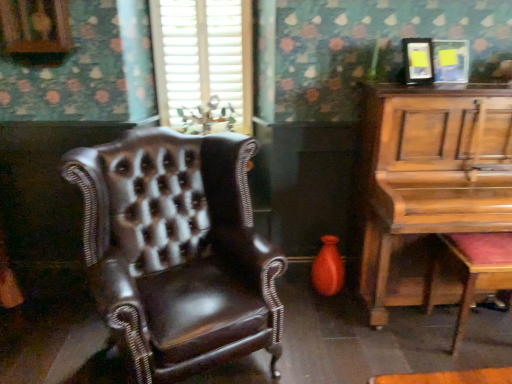
Where is `shiny brown leather chair at left`? Image resolution: width=512 pixels, height=384 pixels. shiny brown leather chair at left is located at coordinates (177, 251).

What do you see at coordinates (203, 56) in the screenshot? I see `white textured blinds at upper center` at bounding box center [203, 56].

What do you see at coordinates (474, 270) in the screenshot?
I see `wooden polished music stool at lower right` at bounding box center [474, 270].

The height and width of the screenshot is (384, 512). In order to click on shiny brown leather chair at left in this screenshot , I will do `click(177, 251)`.

From the image's perspective, is white textured blinds at upper center on wooden piano at right?

Yes, from the image's perspective, white textured blinds at upper center is over wooden piano at right.

Based on their sizes in the image, would you say white textured blinds at upper center is bigger or smaller than wooden piano at right?

Considering their sizes, white textured blinds at upper center takes up less space than wooden piano at right.

How different are the orientations of white textured blinds at upper center and wooden piano at right in degrees?

The angular difference between white textured blinds at upper center and wooden piano at right is 1.1 degrees.

From a real-world perspective, is white textured blinds at upper center physically above wooden piano at right?

Indeed, from a real-world perspective, white textured blinds at upper center stands above wooden piano at right.

Would you consider shiny brown leather chair at left to be distant from white textured blinds at upper center?

shiny brown leather chair at left is near white textured blinds at upper center, not far away.

From the image's perspective, does shiny brown leather chair at left appear lower than white textured blinds at upper center?

Yes.

In terms of height, does shiny brown leather chair at left look taller or shorter compared to white textured blinds at upper center?

Considering their sizes, shiny brown leather chair at left has less height than white textured blinds at upper center.

Where is `chair on the left of white textured blinds at upper center`? chair on the left of white textured blinds at upper center is located at coordinates (177, 251).

From a real-world perspective, relative to white textured blinds at upper center, is wooden polished music stool at lower right vertically above or below?

In terms of real-world spatial position, wooden polished music stool at lower right is below white textured blinds at upper center.

Is wooden polished music stool at lower right bigger than white textured blinds at upper center?

Indeed, wooden polished music stool at lower right has a larger size compared to white textured blinds at upper center.

Looking at this image, measure the distance between wooden polished music stool at lower right and white textured blinds at upper center.

wooden polished music stool at lower right and white textured blinds at upper center are 1.58 meters apart.

Considering the relative sizes of wooden polished music stool at lower right and white textured blinds at upper center in the image provided, is wooden polished music stool at lower right shorter than white textured blinds at upper center?

Indeed, wooden polished music stool at lower right has a lesser height compared to white textured blinds at upper center.

Considering the relative sizes of wooden polished music stool at lower right and wooden piano at right in the image provided, is wooden polished music stool at lower right wider than wooden piano at right?

Incorrect, the width of wooden polished music stool at lower right does not surpass that of wooden piano at right.

How many degrees apart are the facing directions of wooden polished music stool at lower right and wooden piano at right?

They differ by 180 degrees in their facing directions.

From a real-world perspective, is wooden polished music stool at lower right on wooden piano at right?

No, from a real-world perspective, wooden polished music stool at lower right is not above wooden piano at right.

Is wooden polished music stool at lower right aimed at wooden piano at right?

Yes, wooden polished music stool at lower right is turned towards wooden piano at right.

Is point (113, 254) closer or farther from the camera than point (474, 262)?

Point (113, 254) is closer to the camera than point (474, 262).

From the picture: Between shiny brown leather chair at left and wooden polished music stool at lower right, which one has smaller width?

wooden polished music stool at lower right.

Is shiny brown leather chair at left spatially inside wooden polished music stool at lower right, or outside of it?

The correct answer is: outside.

From the image's perspective, would you say white textured blinds at upper center is positioned over wooden polished music stool at lower right?

Yes, from the image's perspective, white textured blinds at upper center is on top of wooden polished music stool at lower right.

Where is `music stool located in front of the white textured blinds at upper center`? music stool located in front of the white textured blinds at upper center is located at coordinates (474, 270).

Looking at this image, is white textured blinds at upper center bigger than wooden polished music stool at lower right?

No, white textured blinds at upper center is not bigger than wooden polished music stool at lower right.

Can we say white textured blinds at upper center lies outside wooden polished music stool at lower right?

Yes, white textured blinds at upper center is located beyond the bounds of wooden polished music stool at lower right.

Is wooden piano at right to the left of white textured blinds at upper center from the viewer's perspective?

Incorrect, wooden piano at right is not on the left side of white textured blinds at upper center.

Is wooden piano at right inside the boundaries of white textured blinds at upper center, or outside?

wooden piano at right cannot be found inside white textured blinds at upper center.

Does point (361, 150) come closer to viewer compared to point (163, 95)?

Yes, point (361, 150) is in front of point (163, 95).

You are a GUI agent. You are given a task and a screenshot of the screen. Output one action in this format:
    pyautogui.click(x=<x>, y=<y>)
    Task: Click on the window above the wooden piano at right (from a real-world perspective)
    
    Given the screenshot: What is the action you would take?
    pyautogui.click(x=203, y=56)

You are a GUI agent. You are given a task and a screenshot of the screen. Output one action in this format:
    pyautogui.click(x=<x>, y=<y>)
    Task: Click on the window that is above the shiny brown leather chair at left (from the image's perspective)
    
    Given the screenshot: What is the action you would take?
    pyautogui.click(x=203, y=56)

When comparing their distances from shiny brown leather chair at left, does wooden polished music stool at lower right or white textured blinds at upper center seem further?

wooden polished music stool at lower right lies further to shiny brown leather chair at left than the other object.

Estimate the real-world distances between objects in this image. Which object is further from white textured blinds at upper center, shiny brown leather chair at left or wooden polished music stool at lower right?

The object further to white textured blinds at upper center is wooden polished music stool at lower right.

Based on their spatial positions, is white textured blinds at upper center or wooden polished music stool at lower right closer to shiny brown leather chair at left?

white textured blinds at upper center lies closer to shiny brown leather chair at left than the other object.

From the picture: Based on their spatial positions, is shiny brown leather chair at left or wooden piano at right closer to white textured blinds at upper center?

Among the two, shiny brown leather chair at left is located nearer to white textured blinds at upper center.

Considering their positions, is white textured blinds at upper center positioned closer to shiny brown leather chair at left than wooden piano at right?

white textured blinds at upper center.

Based on their spatial positions, is wooden polished music stool at lower right or shiny brown leather chair at left further from white textured blinds at upper center?

Among the two, wooden polished music stool at lower right is located further to white textured blinds at upper center.

Which object lies further to the anchor point white textured blinds at upper center, wooden piano at right or wooden polished music stool at lower right?

wooden polished music stool at lower right lies further to white textured blinds at upper center than the other object.

Considering their positions, is white textured blinds at upper center positioned further to wooden piano at right than wooden polished music stool at lower right?

Result: The object further to wooden piano at right is white textured blinds at upper center.

At what (x,y) coordinates should I click in order to perform the action: click on table situated between white textured blinds at upper center and wooden polished music stool at lower right from left to right. Please return your answer as a coordinate pair (x, y). This screenshot has height=384, width=512. Looking at the image, I should click on (428, 179).

The height and width of the screenshot is (384, 512). In order to click on table situated between shiny brown leather chair at left and wooden polished music stool at lower right from left to right in this screenshot , I will do pyautogui.click(x=428, y=179).

Identify the location of window located between shiny brown leather chair at left and wooden piano at right in the left-right direction. (203, 56).

Where is `window situated between shiny brown leather chair at left and wooden polished music stool at lower right from left to right`? The height and width of the screenshot is (384, 512). window situated between shiny brown leather chair at left and wooden polished music stool at lower right from left to right is located at coordinates (203, 56).